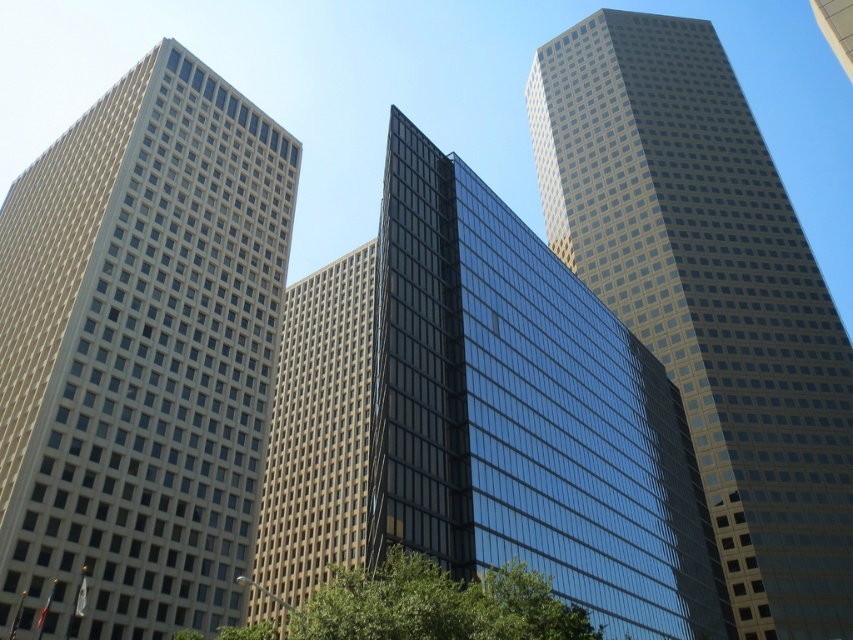
Question: Can you confirm if beige glass building at left is positioned below green leafy tree at lower center?

Choices:
 (A) no
 (B) yes

Answer: (A)

Question: Based on their relative distances, which object is nearer to the glassy reflective skyscraper at center?

Choices:
 (A) beige glass building at left
 (B) matte glass skyscraper at upper right

Answer: (A)

Question: Considering the relative positions of beige glass building at left and matte glass skyscraper at upper right in the image provided, where is beige glass building at left located with respect to matte glass skyscraper at upper right?

Choices:
 (A) below
 (B) above

Answer: (A)

Question: Observing the image, what is the correct spatial positioning of beige glass building at left in reference to matte glass skyscraper at upper right?

Choices:
 (A) left
 (B) right

Answer: (A)

Question: Estimate the real-world distances between objects in this image. Which object is farther from the beige glass building at left?

Choices:
 (A) glassy reflective skyscraper at center
 (B) matte glass skyscraper at upper right
 (C) green leafy tree at lower center

Answer: (B)

Question: Which is nearer to the glassy reflective skyscraper at center?

Choices:
 (A) green leafy tree at lower center
 (B) matte glass skyscraper at upper right
 (C) beige glass building at left

Answer: (A)